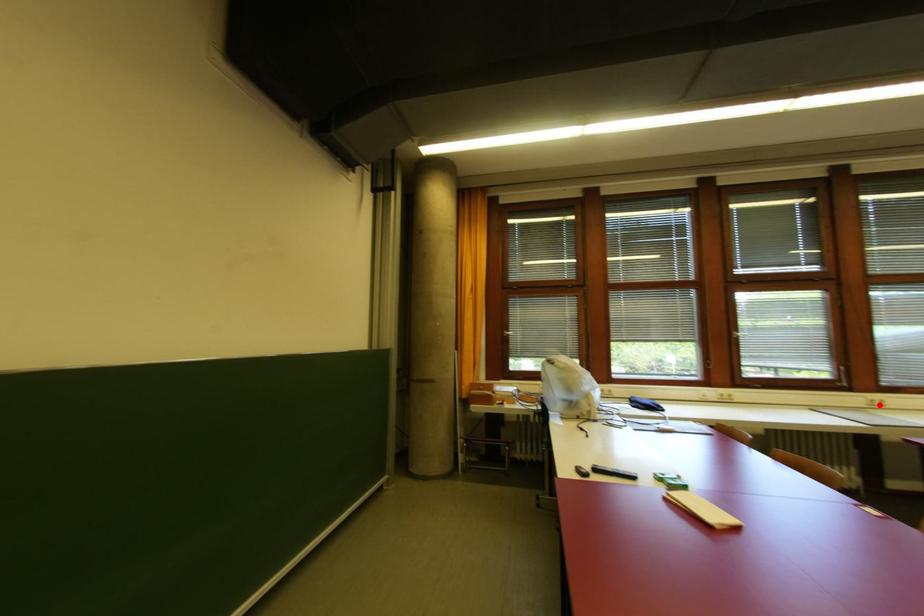
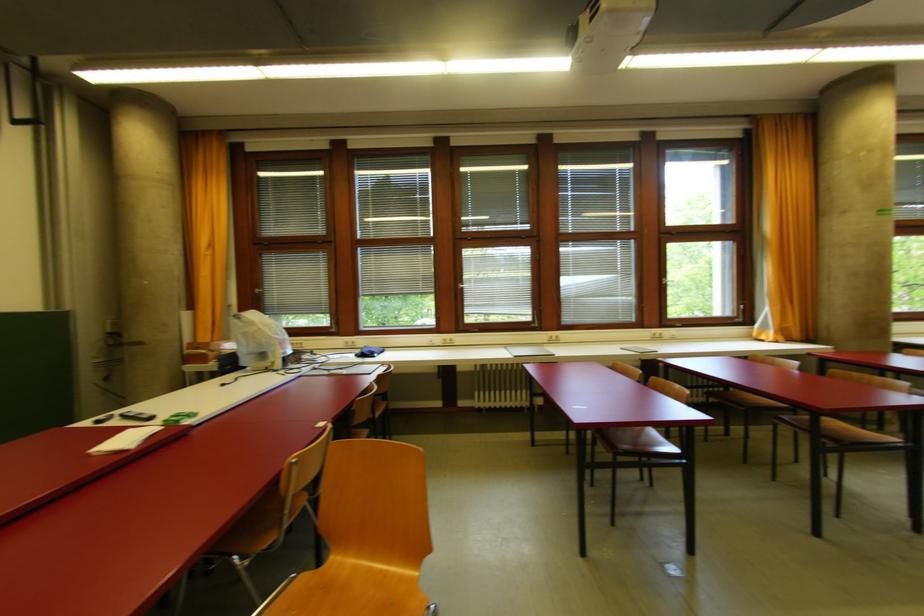
Question: I am providing you with two images of the same scene from different viewpoints. Given a red point in image1, look at the same physical point in image2. Is it:

Choices:
 (A) Closer to the viewpoint
 (B) Farther from the viewpoint

Answer: (B)